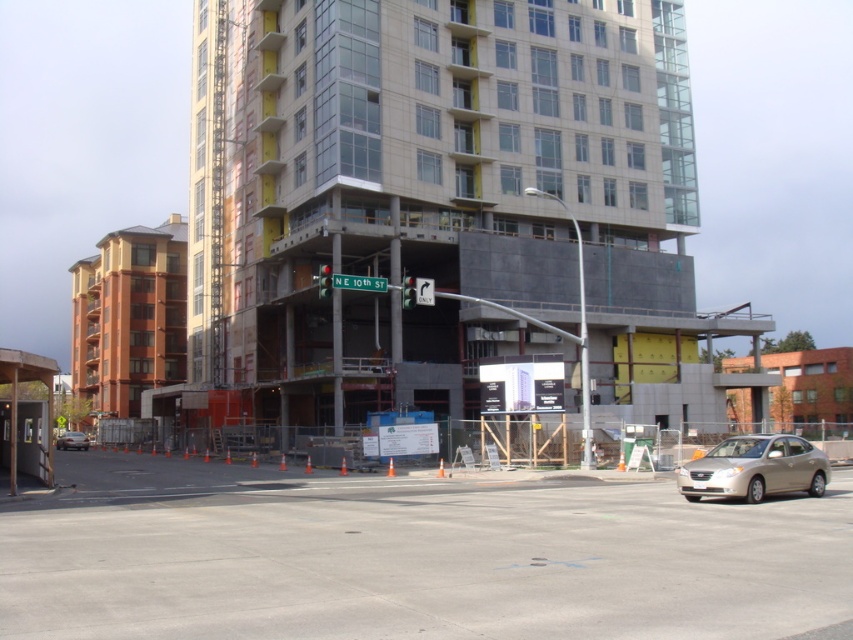
Is green metallic street sign at upper center shorter than green glass traffic light at center?

Indeed, green metallic street sign at upper center has a lesser height compared to green glass traffic light at center.

Is the position of green metallic street sign at upper center more distant than that of green glass traffic light at center?

Yes, green metallic street sign at upper center is behind green glass traffic light at center.

Between point (335, 276) and point (412, 288), which one is positioned in front?

Point (412, 288) is more forward.

Where is `green metallic street sign at upper center`? The width and height of the screenshot is (853, 640). green metallic street sign at upper center is located at coordinates tap(358, 282).

Can you confirm if red glass traffic light at center is smaller than green glass traffic light at center?

No.

Can you confirm if red glass traffic light at center is thinner than green glass traffic light at center?

→ In fact, red glass traffic light at center might be wider than green glass traffic light at center.

Where is `red glass traffic light at center`? The image size is (853, 640). red glass traffic light at center is located at coordinates (323, 280).

Between point (701, 467) and point (326, 280), which one is positioned in front?

Positioned in front is point (701, 467).

Identify the location of gold metallic sedan at lower right. The height and width of the screenshot is (640, 853). click(x=755, y=468).